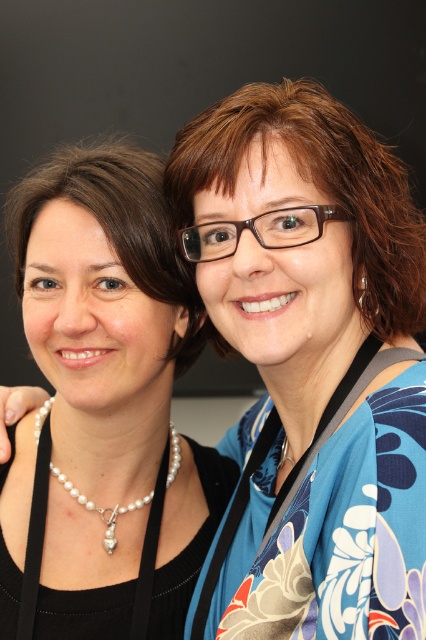
Question: Is blue floral kimono at center positioned in front of pearl necklace at left?

Choices:
 (A) yes
 (B) no

Answer: (A)

Question: In this image, where is blue floral kimono at center located relative to pearl necklace at left?

Choices:
 (A) left
 (B) right

Answer: (B)

Question: Which of the following is the closest to the observer?

Choices:
 (A) (166, 573)
 (B) (351, 160)

Answer: (B)

Question: Which point is farther from the camera taking this photo?

Choices:
 (A) (411, 328)
 (B) (45, 589)

Answer: (B)

Question: Which point is farther to the camera?

Choices:
 (A) pearl necklace at left
 (B) blue floral kimono at center

Answer: (A)

Question: Is the position of blue floral kimono at center less distant than that of pearl necklace at left?

Choices:
 (A) yes
 (B) no

Answer: (A)